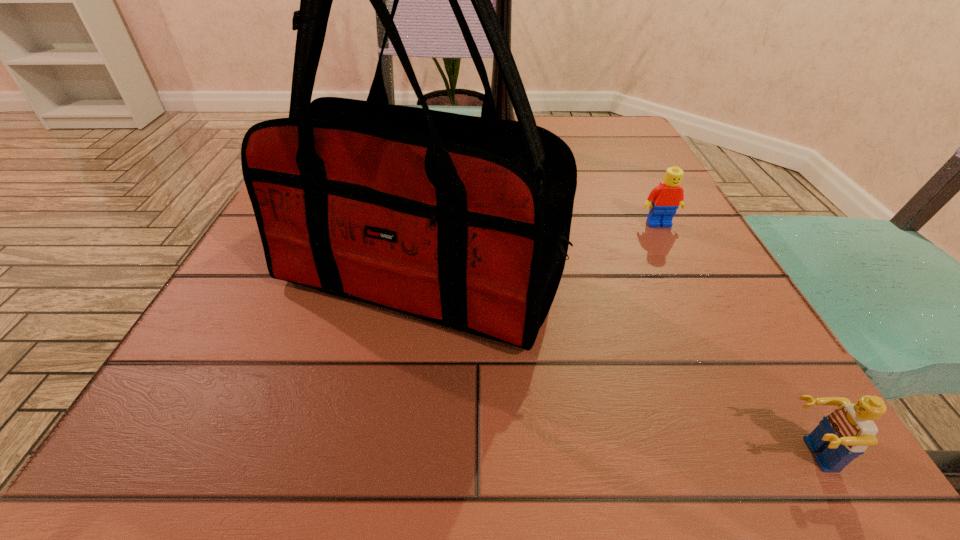
Where is `vacant space located on the face of the nearer Lego`? vacant space located on the face of the nearer Lego is located at coordinates (538, 454).

The image size is (960, 540). Find the location of `object located in the far edge section of the desktop`. object located in the far edge section of the desktop is located at coordinates (503, 6).

Locate an element on the screen. This screenshot has height=540, width=960. object that is at the near edge is located at coordinates (844, 434).

Where is `object that is at the left edge`? object that is at the left edge is located at coordinates (463, 221).

Identify the location of object located in the near right corner section of the desktop. The width and height of the screenshot is (960, 540). (844, 434).

Locate an element on the screen. The height and width of the screenshot is (540, 960). vacant space at the far edge of the desktop is located at coordinates (571, 141).

The height and width of the screenshot is (540, 960). In order to click on vacant space at the left edge of the desktop in this screenshot , I will do `click(279, 328)`.

Locate an element on the screen. vacant area at the right edge of the desktop is located at coordinates (584, 167).

In the image, there is a desktop. Identify the location of vacant space at the near left corner. [255, 464].

At what (x,y) coordinates should I click in order to perform the action: click on free space at the far right corner of the desktop. Please return your answer as a coordinate pair (x, y). The height and width of the screenshot is (540, 960). Looking at the image, I should click on (580, 120).